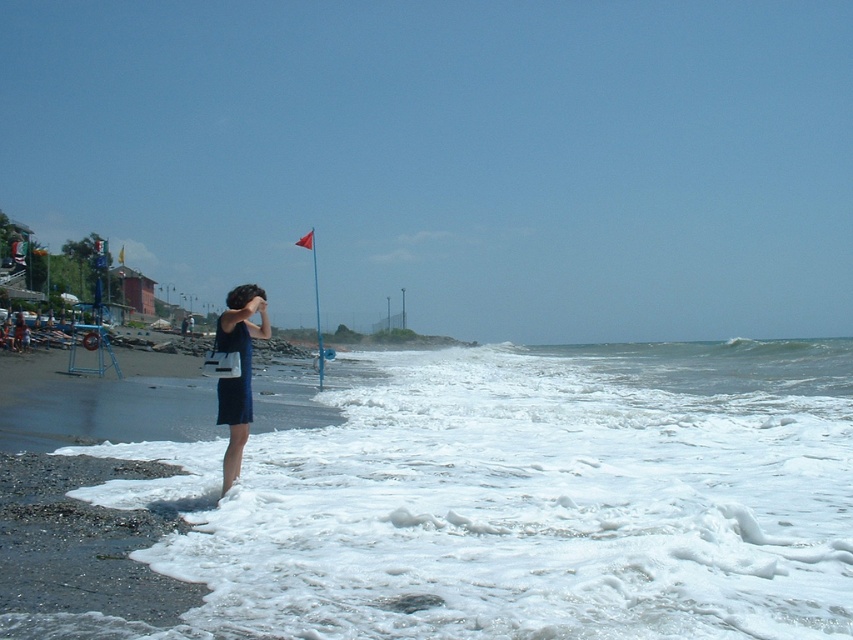
You are standing on the beach and want to place a small red flag exactly where the white foamy water at lower left is located. According to the coordinates provided, where should you place the flag?

The white foamy water at lower left is located at point (547, 499), so you should place the flag at those coordinates.

You are a photographer trying to capture the perfect shot of the white foamy water at lower left and the matte blue dress at center. Which object appears taller in the image?

The matte blue dress at center is taller than the white foamy water at lower left.